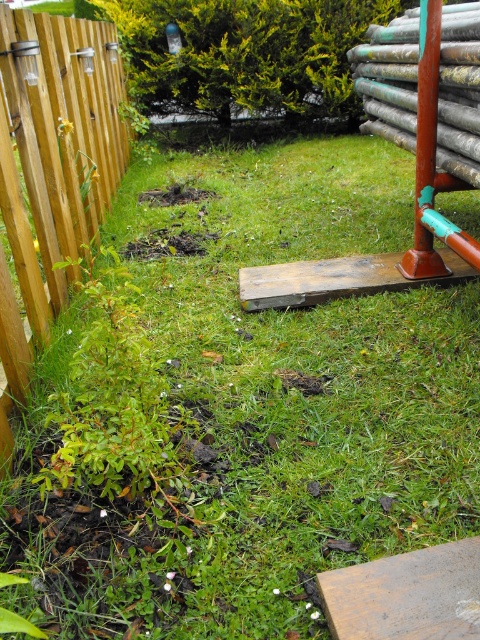
Question: Which point is farther to the camera?

Choices:
 (A) wooden fence at left
 (B) rusty metal pole at right

Answer: (B)

Question: In this image, where is wooden fence at left located relative to rusty metal pole at right?

Choices:
 (A) right
 (B) left

Answer: (B)

Question: Which point is closer to the camera?

Choices:
 (A) (95, 184)
 (B) (429, 122)

Answer: (B)

Question: Does wooden fence at left have a smaller size compared to rusty metal pole at right?

Choices:
 (A) yes
 (B) no

Answer: (B)

Question: Among these objects, which one is nearest to the camera?

Choices:
 (A) rusty metal pole at right
 (B) wooden fence at left

Answer: (B)

Question: Does wooden fence at left appear under rusty metal pole at right?

Choices:
 (A) no
 (B) yes

Answer: (A)